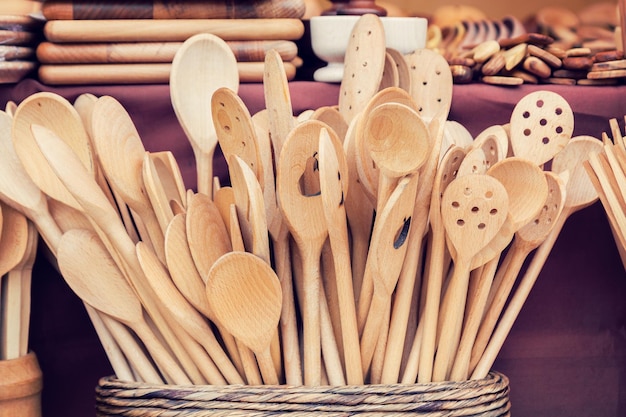
Find the location of a particular element. This screenshot has width=626, height=417. tablecloth is located at coordinates (588, 103).